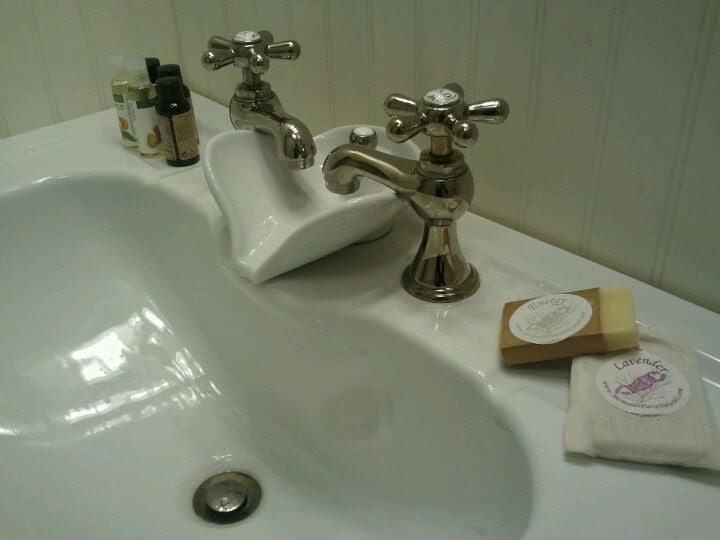
You are a GUI agent. You are given a task and a screenshot of the screen. Output one action in this format:
    pyautogui.click(x=<x>, y=<y>)
    Task: Click on the wall to left of sink
    The height and width of the screenshot is (540, 720).
    Given the screenshot: What is the action you would take?
    pyautogui.click(x=66, y=60)